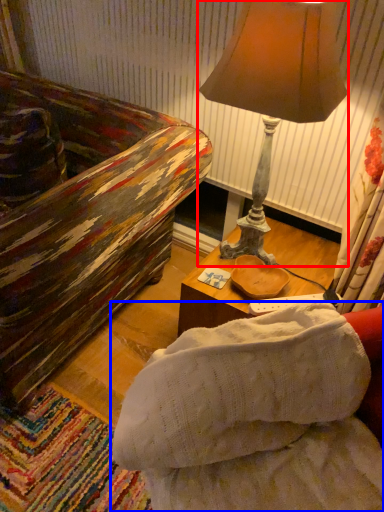
Question: Which object appears closest to the camera in this image, lamp (highlighted by a red box) or studio couch (highlighted by a blue box)?

Choices:
 (A) lamp
 (B) studio couch

Answer: (B)